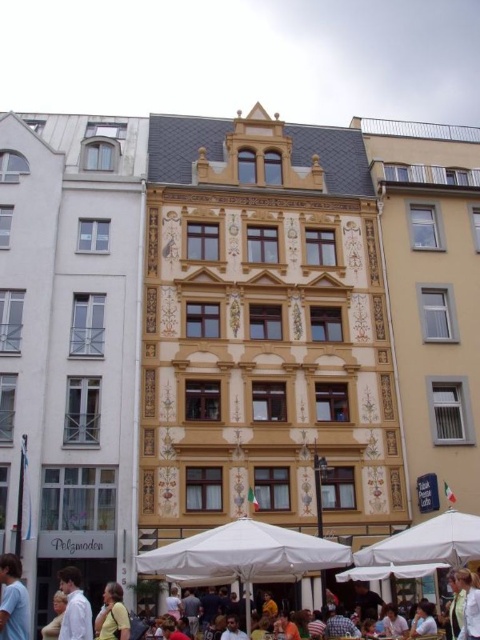
Question: Considering the relative positions of light blue t-shirt at lower left and yellow shirt at lower center in the image provided, where is light blue t-shirt at lower left located with respect to yellow shirt at lower center?

Choices:
 (A) above
 (B) below

Answer: (A)

Question: Can you confirm if white fabric umbrella at lower center is smaller than white shirt at lower left?

Choices:
 (A) yes
 (B) no

Answer: (B)

Question: Which point is closer to the camera?

Choices:
 (A) (80, 576)
 (B) (323, 556)
 (C) (120, 634)
 (D) (12, 632)

Answer: (D)

Question: Among these objects, which one is farthest from the camera?

Choices:
 (A) white shirt at lower left
 (B) yellow shirt at lower center

Answer: (B)

Question: Can you confirm if white fabric umbrella at lower center is smaller than yellow shirt at lower center?

Choices:
 (A) yes
 (B) no

Answer: (B)

Question: Which object appears closest to the camera in this image?

Choices:
 (A) yellow shirt at lower center
 (B) light blue t-shirt at lower left
 (C) white shirt at lower left

Answer: (B)